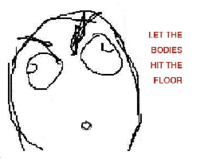
Image resolution: width=200 pixels, height=159 pixels. Find the location of `word 'floor'`. word 'floor' is located at coordinates (174, 79), (30, 83).